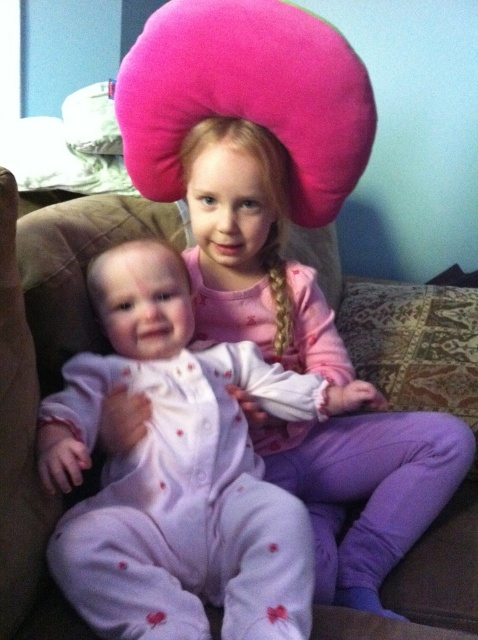
Who is positioned more to the left, matte pink pajamas at center or pink soft pajamas at center?

From the viewer's perspective, matte pink pajamas at center appears more on the left side.

Is matte pink pajamas at center to the right of pink soft pajamas at center from the viewer's perspective?

In fact, matte pink pajamas at center is to the left of pink soft pajamas at center.

Does point (101, 365) come in front of point (318, 424)?

Yes, it is in front of point (318, 424).

Identify the location of matte pink pajamas at center. (177, 472).